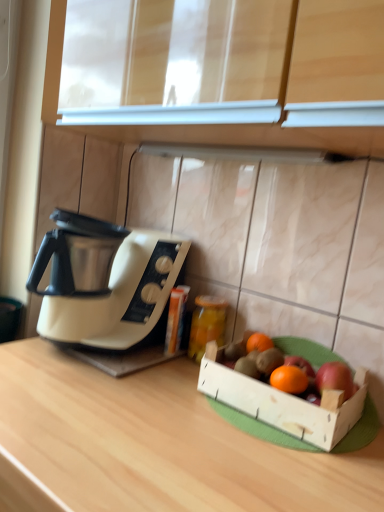
Question: Considering the relative sizes of red matte apple at right and orange matte grapefruit at center, the first grapefruit when ordered from front to back, in the image provided, is red matte apple at right wider than orange matte grapefruit at center, the first grapefruit when ordered from front to back,?

Choices:
 (A) no
 (B) yes

Answer: (B)

Question: Is red matte apple at right positioned behind orange matte grapefruit at center, the 2th grapefruit from the back?

Choices:
 (A) no
 (B) yes

Answer: (A)

Question: Would you say orange matte grapefruit at center, the 2th grapefruit from the back, is part of red matte apple at right's contents?

Choices:
 (A) yes
 (B) no

Answer: (B)

Question: Is red matte apple at right next to orange matte grapefruit at center, the 2th grapefruit from the back, and touching it?

Choices:
 (A) yes
 (B) no

Answer: (A)

Question: Is red matte apple at right outside of orange matte grapefruit at center, the first grapefruit when ordered from front to back?

Choices:
 (A) no
 (B) yes

Answer: (B)

Question: Does red matte apple at right have a lesser width compared to orange matte grapefruit at center, the first grapefruit when ordered from front to back?

Choices:
 (A) yes
 (B) no

Answer: (B)

Question: From the image's perspective, is orange matte grapefruit at center, the first grapefruit when ordered from front to back, located above red matte apple at right?

Choices:
 (A) no
 (B) yes

Answer: (A)

Question: Is orange matte grapefruit at center, the 2th grapefruit from the back, positioned beyond the bounds of red matte apple at right?

Choices:
 (A) no
 (B) yes

Answer: (B)

Question: Does orange matte grapefruit at center, the 2th grapefruit from the back, have a larger size compared to red matte apple at right?

Choices:
 (A) yes
 (B) no

Answer: (B)

Question: Is the surface of orange matte grapefruit at center, the first grapefruit when ordered from front to back, in direct contact with red matte apple at right?

Choices:
 (A) no
 (B) yes

Answer: (B)

Question: Considering the relative sizes of orange matte grapefruit at center, the 2th grapefruit from the back, and red matte apple at right in the image provided, is orange matte grapefruit at center, the 2th grapefruit from the back, thinner than red matte apple at right?

Choices:
 (A) no
 (B) yes

Answer: (B)

Question: From a real-world perspective, is orange matte grapefruit at center, the 2th grapefruit from the back, physically below red matte apple at right?

Choices:
 (A) no
 (B) yes

Answer: (B)

Question: Does white plastic coffee maker at left have a greater width compared to wooden at center?

Choices:
 (A) no
 (B) yes

Answer: (A)